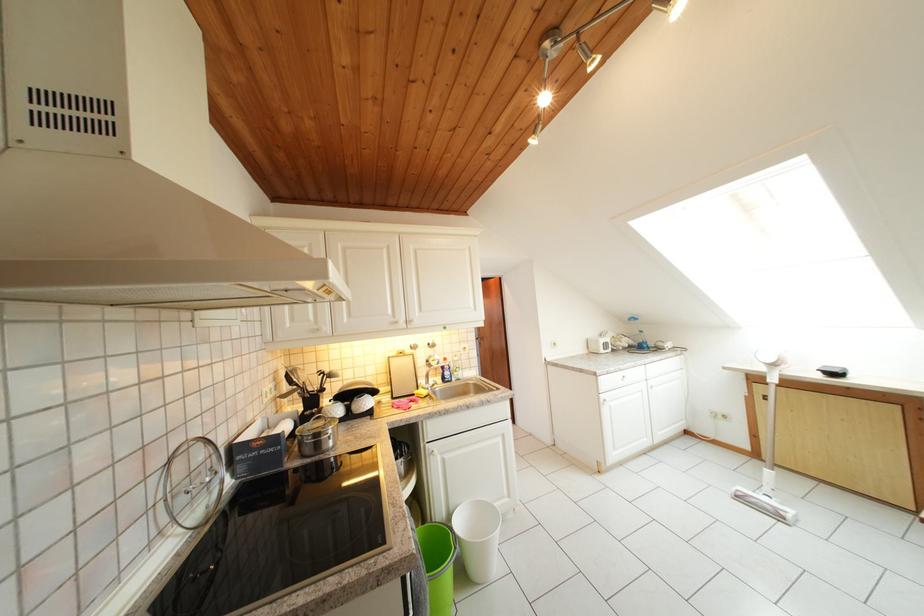
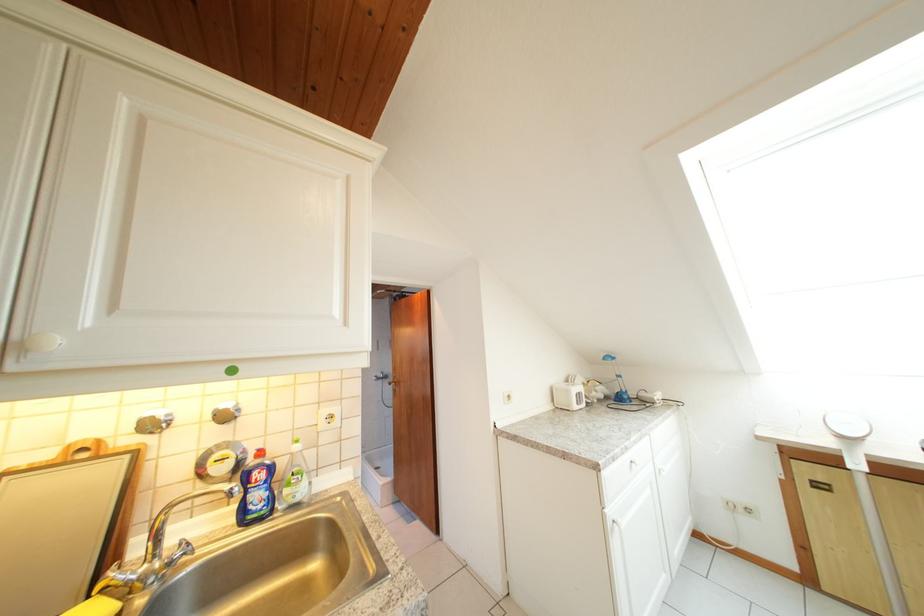
Locate, in the second image, the point that corresponds to (605,347) in the first image.

(577, 397)